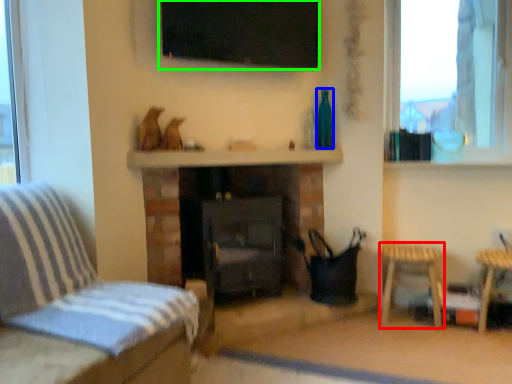
Question: Considering the real-world distances, which object is closest to table (highlighted by a red box)? bottle (highlighted by a blue box) or window screen (highlighted by a green box).

Choices:
 (A) bottle
 (B) window screen

Answer: (A)